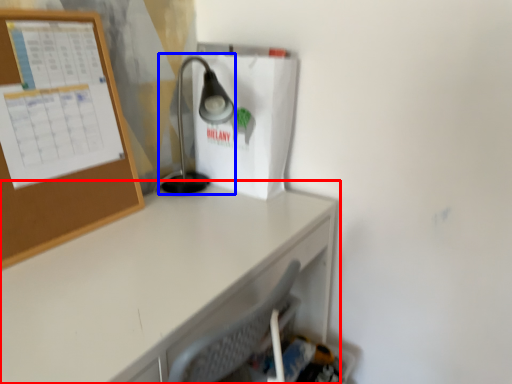
Question: Which object appears closest to the camera in this image, desk (highlighted by a red box) or lamp (highlighted by a blue box)?

Choices:
 (A) desk
 (B) lamp

Answer: (A)